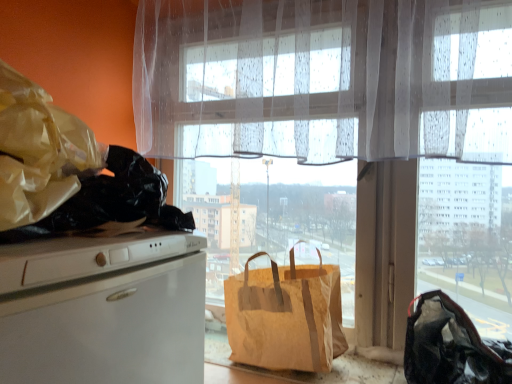
Question: Relative to translucent fabric window at center, is black fabric bag at lower right, acting as the 1th handbag starting from the right, in front or behind?

Choices:
 (A) behind
 (B) front

Answer: (B)

Question: In terms of size, does black fabric bag at lower right, acting as the 1th handbag starting from the right, appear bigger or smaller than translucent fabric window at center?

Choices:
 (A) small
 (B) big

Answer: (A)

Question: Which of these objects is positioned closest to the brown paper bag at window, the first handbag when ordered from left to right?

Choices:
 (A) translucent white curtain at upper center
 (B) translucent fabric window at center
 (C) black fabric bag at lower right, acting as the 2th handbag starting from the left

Answer: (B)

Question: Considering the real-world distances, which object is farthest from the black fabric bag at lower right, acting as the 2th handbag starting from the left?

Choices:
 (A) translucent white curtain at upper center
 (B) translucent fabric window at center
 (C) brown paper bag at window, the second handbag viewed from the right

Answer: (A)